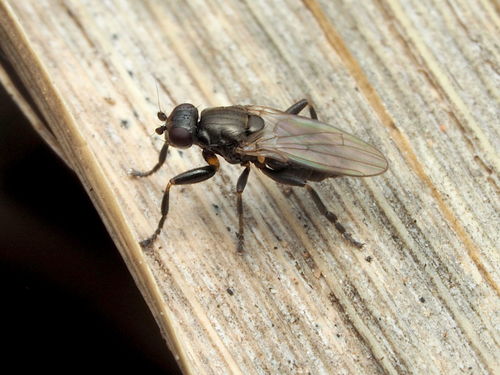
Identify the location of dark spots on wood. (231, 288), (227, 228), (217, 209), (123, 121), (122, 73).